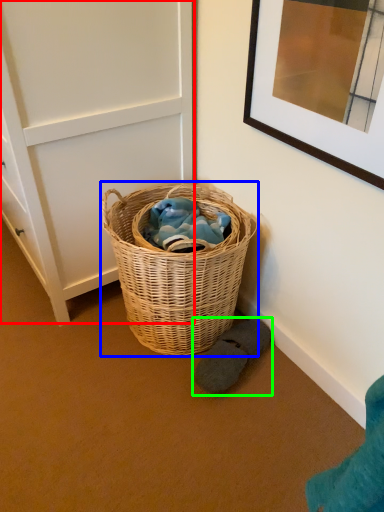
Question: Which object is positioned farthest from door (highlighted by a red box)? Select from picnic basket (highlighted by a blue box) and footwear (highlighted by a green box).

Choices:
 (A) picnic basket
 (B) footwear

Answer: (B)